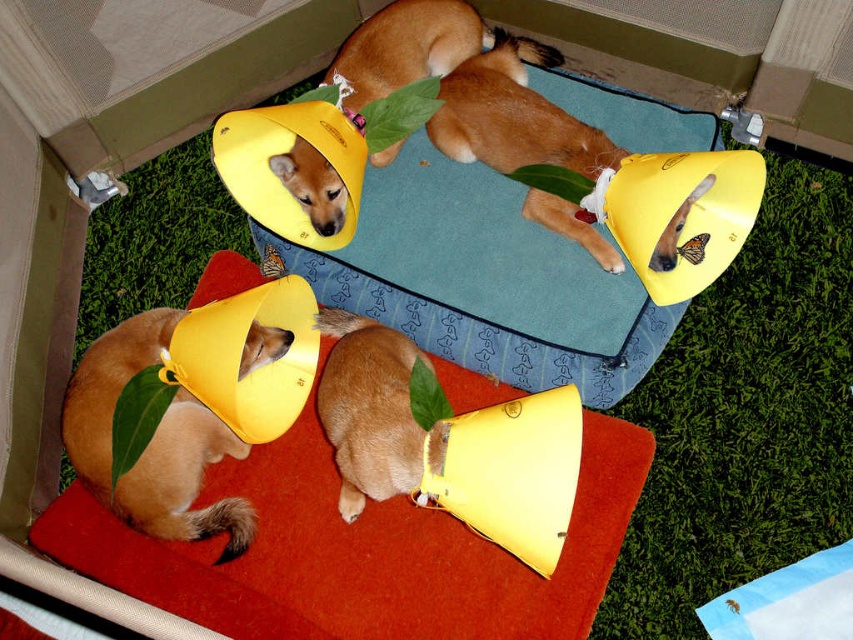
Is point (549, 237) farther from viewer compared to point (247, 508)?

Yes.

Is blue fabric dog bed at center closer to camera compared to golden fur dog at lower left?

That is False.

Describe the element at coordinates (482, 280) in the screenshot. The height and width of the screenshot is (640, 853). I see `blue fabric dog bed at center` at that location.

Find the location of a particular element. blue fabric dog bed at center is located at coordinates (482, 280).

Is golden fur dog at lower left below light brown fur at center?

Incorrect, golden fur dog at lower left is not positioned below light brown fur at center.

Is golden fur dog at lower left further to the viewer compared to light brown fur at center?

Yes, golden fur dog at lower left is behind light brown fur at center.

I want to click on golden fur dog at lower left, so click(x=152, y=442).

This screenshot has width=853, height=640. I want to click on golden fur dog at lower left, so click(152, 442).

Consider the image. Is soft orange carpet at lower center positioned before blue fabric dog bed at center?

Yes, soft orange carpet at lower center is closer to the viewer.

Identify the location of soft orange carpet at lower center. (358, 552).

Who is more distant from viewer, (183, 572) or (384, 307)?

Positioned behind is point (384, 307).

Locate an element on the screen. The height and width of the screenshot is (640, 853). soft orange carpet at lower center is located at coordinates (358, 552).